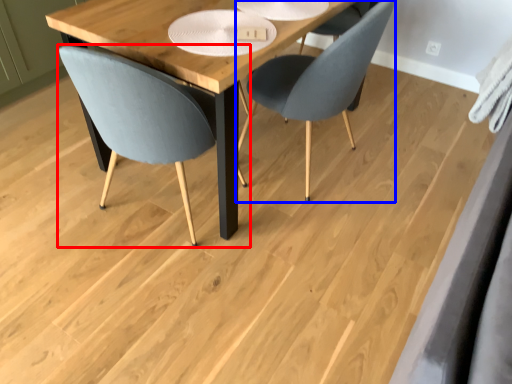
Question: Which object appears farthest to the camera in this image, chair (highlighted by a red box) or chair (highlighted by a blue box)?

Choices:
 (A) chair
 (B) chair

Answer: (B)